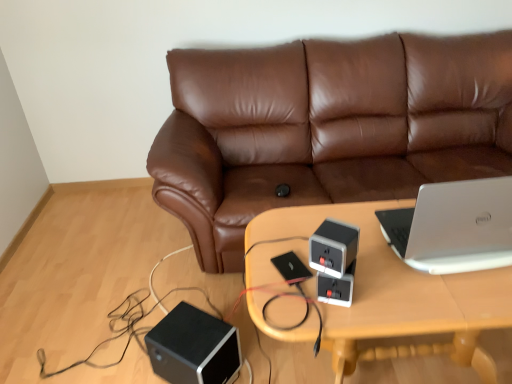
Measure the distance between point (175,333) and camera.

Point (175,333) is 5.10 feet from camera.

Describe the element at coordinates (454, 226) in the screenshot. The image size is (512, 384). I see `silver metallic laptop at right` at that location.

Locate an element on the screen. brown leather couch at center is located at coordinates (326, 128).

Locate an element on the screen. wooden table at center is located at coordinates (378, 294).

Is black matte speaker at lower left, which ranks as the first speaker in bottom-to-top order, looking in the opposite direction of wooden table at center?

That's not correct — black matte speaker at lower left, which ranks as the first speaker in bottom-to-top order, is not looking away from wooden table at center.

Are black matte speaker at lower left, marked as the second speaker in a top-to-bottom arrangement, and wooden table at center located far from each other?

No, there isn't a large distance between black matte speaker at lower left, marked as the second speaker in a top-to-bottom arrangement, and wooden table at center.

Is black matte speaker at lower left, placed as the second speaker when sorted from front to back, surrounding wooden table at center?

No.

From a real-world perspective, which object stands above the other?

In real-world perspective, wooden table at center is above.

From a real-world perspective, is brown leather couch at center located higher than gray matte speaker at center, which ranks as the first speaker in front-to-back order?

No.

Does brown leather couch at center turn towards gray matte speaker at center, which is the 2th speaker in left-to-right order?

Yes.

Based on the photo, which object is thinner, brown leather couch at center or gray matte speaker at center, which is counted as the second speaker, starting from the back?

Thinner between the two is gray matte speaker at center, which is counted as the second speaker, starting from the back.

In the scene shown: From the image's perspective, is brown leather couch at center on top of gray matte speaker at center, which is the 1th speaker from top to bottom?

Yes, from the image's perspective, brown leather couch at center is above gray matte speaker at center, which is the 1th speaker from top to bottom.

Between gray matte speaker at center, which is the 2th speaker in left-to-right order, and wooden table at center, which one has smaller size?

Smaller between the two is gray matte speaker at center, which is the 2th speaker in left-to-right order.

Considering the positions of point (338, 257) and point (362, 269), is point (338, 257) closer or farther from the camera than point (362, 269)?

Clearly, point (338, 257) is closer to the camera than point (362, 269).

From a real-world perspective, between gray matte speaker at center, which is the 1th speaker from top to bottom, and wooden table at center, who is vertically lower?

In real-world perspective, wooden table at center is lower.

Relative to wooden table at center, is gray matte speaker at center, which is the 1th speaker from top to bottom, in front or behind?

Visually, gray matte speaker at center, which is the 1th speaker from top to bottom, is located in front of wooden table at center.

From the image's perspective, which is below, gray matte speaker at center, which is the 2th speaker in left-to-right order, or brown leather couch at center?

gray matte speaker at center, which is the 2th speaker in left-to-right order, appears lower in the image.

Based on the photo, is gray matte speaker at center, which is the 2th speaker in left-to-right order, located outside brown leather couch at center?

Yes, gray matte speaker at center, which is the 2th speaker in left-to-right order, is outside of brown leather couch at center.

In terms of size, does gray matte speaker at center, which is the 1th speaker from top to bottom, appear bigger or smaller than brown leather couch at center?

In the image, gray matte speaker at center, which is the 1th speaker from top to bottom, appears to be smaller than brown leather couch at center.

Is gray matte speaker at center, which is the 2th speaker in left-to-right order, turned away from brown leather couch at center?

That's not correct — gray matte speaker at center, which is the 2th speaker in left-to-right order, is not looking away from brown leather couch at center.

From a real-world perspective, is silver metallic laptop at right on gray matte speaker at center, marked as the first speaker in a right-to-left arrangement?

Answer: Indeed, from a real-world perspective, silver metallic laptop at right stands above gray matte speaker at center, marked as the first speaker in a right-to-left arrangement.

Can you confirm if silver metallic laptop at right is bigger than gray matte speaker at center, which ranks as the second speaker in bottom-to-top order?

Yes, silver metallic laptop at right is bigger than gray matte speaker at center, which ranks as the second speaker in bottom-to-top order.

From the picture: Is silver metallic laptop at right aimed at gray matte speaker at center, which is counted as the second speaker, starting from the back?

No, silver metallic laptop at right is not turned towards gray matte speaker at center, which is counted as the second speaker, starting from the back.

Considering the positions of point (228, 328) and point (184, 103), is point (228, 328) closer or farther from the camera than point (184, 103)?

Clearly, point (228, 328) is closer to the camera than point (184, 103).

In the scene shown: From the image's perspective, between black matte speaker at lower left, placed as the second speaker when sorted from front to back, and brown leather couch at center, who is located below?

black matte speaker at lower left, placed as the second speaker when sorted from front to back, is shown below in the image.

From a real-world perspective, which object rests below the other?

In real-world perspective, black matte speaker at lower left, the first speaker viewed from the back, is lower.

Identify the location of speaker below the brown leather couch at center (from a real-world perspective). (193, 347).

Is black matte speaker at lower left, placed as the second speaker when sorted from front to back, bigger than gray matte speaker at center, marked as the first speaker in a right-to-left arrangement?

Yes, black matte speaker at lower left, placed as the second speaker when sorted from front to back, is bigger than gray matte speaker at center, marked as the first speaker in a right-to-left arrangement.

Is black matte speaker at lower left, marked as the second speaker in a top-to-bottom arrangement, in front of or behind gray matte speaker at center, which ranks as the second speaker in bottom-to-top order, in the image?

Visually, black matte speaker at lower left, marked as the second speaker in a top-to-bottom arrangement, is located behind gray matte speaker at center, which ranks as the second speaker in bottom-to-top order.

Which of these two, black matte speaker at lower left, marked as the first speaker in a left-to-right arrangement, or gray matte speaker at center, which is the 1th speaker from top to bottom, stands taller?

Standing taller between the two is black matte speaker at lower left, marked as the first speaker in a left-to-right arrangement.

Considering the points (172, 361) and (336, 266), which point is behind, point (172, 361) or point (336, 266)?

The point (172, 361) is farther.

Starting from the wooden table at center, which speaker is the 2nd one to the left? Please provide its 2D coordinates.

[(193, 347)]

Where is `studio couch on the right of the gray matte speaker at center, which ranks as the first speaker in front-to-back order`? studio couch on the right of the gray matte speaker at center, which ranks as the first speaker in front-to-back order is located at coordinates (326, 128).

Considering their positions, is black matte speaker at lower left, marked as the second speaker in a top-to-bottom arrangement, positioned closer to gray matte speaker at center, which is counted as the second speaker, starting from the back, than wooden table at center?

Based on the image, wooden table at center appears to be nearer to gray matte speaker at center, which is counted as the second speaker, starting from the back.

Estimate the real-world distances between objects in this image. Which object is closer to silver metallic laptop at right, gray matte speaker at center, marked as the first speaker in a right-to-left arrangement, or wooden table at center?

wooden table at center.

Looking at the image, which one is located further to black matte speaker at lower left, acting as the 2th speaker starting from the right, wooden table at center or silver metallic laptop at right?

silver metallic laptop at right is further to black matte speaker at lower left, acting as the 2th speaker starting from the right.

Which object lies nearer to the anchor point gray matte speaker at center, which is the 1th speaker from top to bottom, brown leather couch at center or black matte speaker at lower left, which ranks as the first speaker in bottom-to-top order?

black matte speaker at lower left, which ranks as the first speaker in bottom-to-top order.

Estimate the real-world distances between objects in this image. Which object is closer to brown leather couch at center, gray matte speaker at center, which ranks as the first speaker in front-to-back order, or wooden table at center?

wooden table at center is positioned closer to the anchor brown leather couch at center.

Based on the photo, estimate the real-world distances between objects in this image. Which object is further from brown leather couch at center, silver metallic laptop at right or gray matte speaker at center, which ranks as the second speaker in bottom-to-top order?

gray matte speaker at center, which ranks as the second speaker in bottom-to-top order, is further to brown leather couch at center.

When comparing their distances from silver metallic laptop at right, does black matte speaker at lower left, the first speaker viewed from the back, or wooden table at center seem further?

black matte speaker at lower left, the first speaker viewed from the back, is positioned further to the anchor silver metallic laptop at right.

From the image, which object appears to be nearer to silver metallic laptop at right, gray matte speaker at center, which is the 1th speaker from top to bottom, or black matte speaker at lower left, the first speaker viewed from the back?

Based on the image, gray matte speaker at center, which is the 1th speaker from top to bottom, appears to be nearer to silver metallic laptop at right.

Identify the location of laptop between gray matte speaker at center, which is the 2th speaker in left-to-right order, and brown leather couch at center in the front-back direction. The height and width of the screenshot is (384, 512). (454, 226).

Locate an element on the screen. This screenshot has height=384, width=512. speaker between brown leather couch at center and wooden table at center in the vertical direction is located at coordinates (333, 247).

Find the location of `table situated between black matte speaker at lower left, marked as the second speaker in a top-to-bottom arrangement, and silver metallic laptop at right from left to right`. table situated between black matte speaker at lower left, marked as the second speaker in a top-to-bottom arrangement, and silver metallic laptop at right from left to right is located at coordinates (378, 294).

You are a GUI agent. You are given a task and a screenshot of the screen. Output one action in this format:
    pyautogui.click(x=<x>, y=<y>)
    Task: Click on the speaker between black matte speaker at lower left, marked as the second speaker in a top-to-bottom arrangement, and silver metallic laptop at right
    
    Given the screenshot: What is the action you would take?
    pyautogui.click(x=333, y=247)